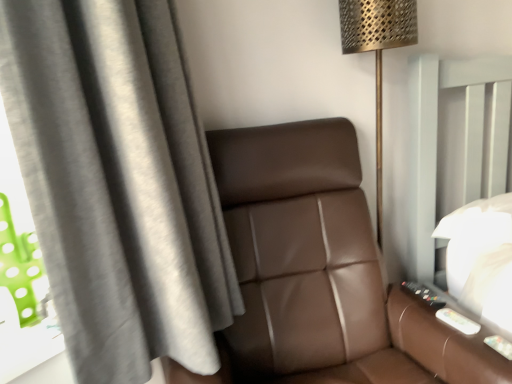
In order to face brown leather chair at center, should I rotate leftwards or rightwards?

You should rotate right by 9.520 degrees.

Describe the element at coordinates (118, 184) in the screenshot. This screenshot has width=512, height=384. I see `gray fabric curtain at left` at that location.

Locate an element on the screen. brown leather chair at center is located at coordinates (321, 272).

Find the location of a particular element. lamp above the brown leather chair at center (from a real-world perspective) is located at coordinates (377, 52).

From the picture: From a real-world perspective, relative to brown leather chair at center, is metallic gold floor lamp at upper right vertically above or below?

metallic gold floor lamp at upper right is above brown leather chair at center.

Is metallic gold floor lamp at upper right positioned far away from brown leather chair at center?

They are positioned close to each other.

Is point (341, 8) closer to viewer compared to point (246, 131)?

No, (341, 8) is further to viewer.

Based on their sizes in the image, would you say gray fabric curtain at left is bigger or smaller than brown leather chair at center?

gray fabric curtain at left is smaller than brown leather chair at center.

Who is shorter, gray fabric curtain at left or brown leather chair at center?

gray fabric curtain at left is shorter.

Considering their positions, is gray fabric curtain at left located in front of or behind brown leather chair at center?

In the image, gray fabric curtain at left appears behind brown leather chair at center.

Is gray fabric curtain at left not near brown leather chair at center?

No, there isn't a large distance between gray fabric curtain at left and brown leather chair at center.

Which of these two, metallic gold floor lamp at upper right or gray fabric curtain at left, stands taller?

metallic gold floor lamp at upper right is taller.

From the image's perspective, is metallic gold floor lamp at upper right located above or below gray fabric curtain at left?

metallic gold floor lamp at upper right is situated higher than gray fabric curtain at left in the image.

Can you confirm if metallic gold floor lamp at upper right is thinner than gray fabric curtain at left?

Yes, metallic gold floor lamp at upper right is thinner than gray fabric curtain at left.

Does metallic gold floor lamp at upper right contain gray fabric curtain at left?

No.

Who is shorter, gray fabric curtain at left or metallic gold floor lamp at upper right?

gray fabric curtain at left is shorter.

From a real-world perspective, is gray fabric curtain at left over metallic gold floor lamp at upper right?

Yes, from a real-world perspective, gray fabric curtain at left is over metallic gold floor lamp at upper right

How far apart are gray fabric curtain at left and metallic gold floor lamp at upper right?

30.41 inches.

Is metallic gold floor lamp at upper right at the back of gray fabric curtain at left?

That's not correct — gray fabric curtain at left is not looking away from metallic gold floor lamp at upper right.

Based on the photo, from the image's perspective, which one is positioned higher, brown leather chair at center or gray fabric curtain at left?

gray fabric curtain at left.

Is brown leather chair at center oriented away from gray fabric curtain at left?

brown leather chair at center does not have its back to gray fabric curtain at left.

Is brown leather chair at center bigger than gray fabric curtain at left?

Yes.

Is brown leather chair at center inside or outside of gray fabric curtain at left?

The correct answer is: outside.

From the picture: Is brown leather chair at center bigger than metallic gold floor lamp at upper right?

Yes.

Relative to metallic gold floor lamp at upper right, is brown leather chair at center in front or behind?

In the image, brown leather chair at center appears in front of metallic gold floor lamp at upper right.

Choose the correct answer: Is brown leather chair at center inside metallic gold floor lamp at upper right or outside it?

brown leather chair at center lies outside metallic gold floor lamp at upper right.

Find the location of a particular element. The height and width of the screenshot is (384, 512). furniture below the metallic gold floor lamp at upper right (from the image's perspective) is located at coordinates (321, 272).

This screenshot has width=512, height=384. Find the location of `curtain positioned vertically above the brown leather chair at center (from a real-world perspective)`. curtain positioned vertically above the brown leather chair at center (from a real-world perspective) is located at coordinates (118, 184).

Estimate the real-world distances between objects in this image. Which object is further from brown leather chair at center, gray fabric curtain at left or metallic gold floor lamp at upper right?

metallic gold floor lamp at upper right is further to brown leather chair at center.

Looking at the image, which one is located further to gray fabric curtain at left, metallic gold floor lamp at upper right or brown leather chair at center?

metallic gold floor lamp at upper right lies further to gray fabric curtain at left than the other object.

Based on their spatial positions, is brown leather chair at center or metallic gold floor lamp at upper right closer to gray fabric curtain at left?

The object closer to gray fabric curtain at left is brown leather chair at center.

Considering their positions, is brown leather chair at center positioned further to metallic gold floor lamp at upper right than gray fabric curtain at left?

gray fabric curtain at left is positioned further to the anchor metallic gold floor lamp at upper right.

From the picture: From the image, which object appears to be nearer to metallic gold floor lamp at upper right, gray fabric curtain at left or brown leather chair at center?

brown leather chair at center is positioned closer to the anchor metallic gold floor lamp at upper right.

Based on their spatial positions, is metallic gold floor lamp at upper right or gray fabric curtain at left further from brown leather chair at center?

metallic gold floor lamp at upper right lies further to brown leather chair at center than the other object.

This screenshot has height=384, width=512. In order to click on furniture between gray fabric curtain at left and metallic gold floor lamp at upper right in this screenshot , I will do `click(321, 272)`.